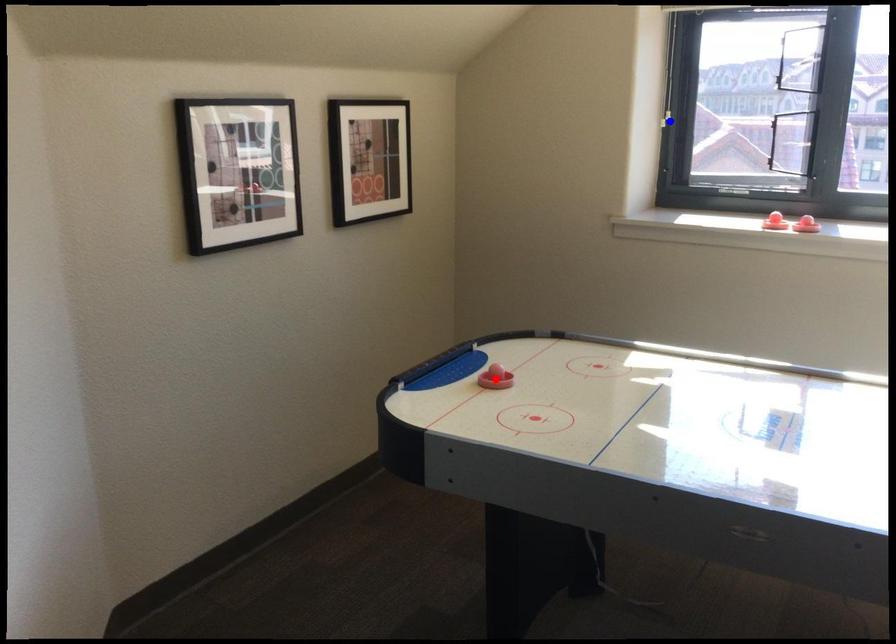
Question: Which of the two points in the image is closer to the camera?

Choices:
 (A) Blue point is closer.
 (B) Red point is closer.

Answer: (B)